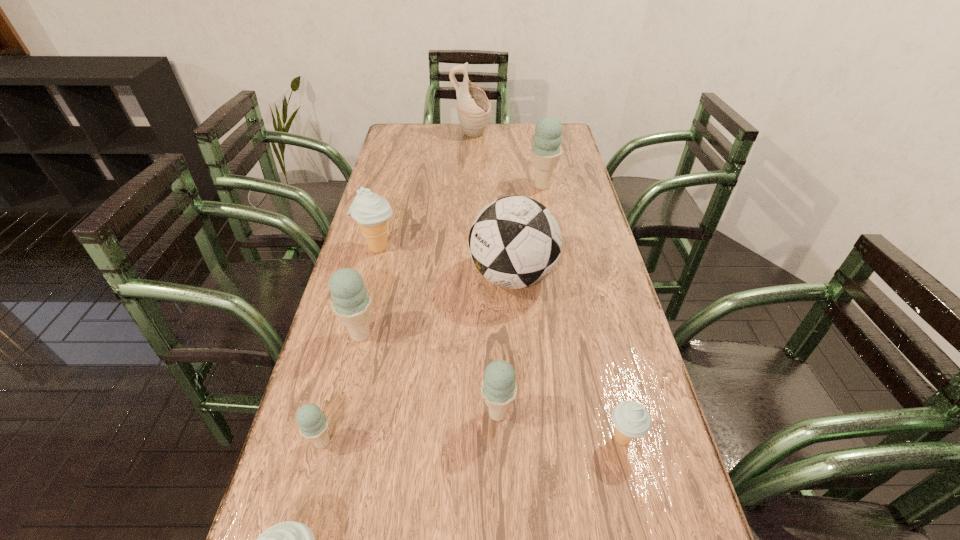
The width and height of the screenshot is (960, 540). In order to click on pitcher in this screenshot , I will do `click(473, 107)`.

Locate an element on the screen. Image resolution: width=960 pixels, height=540 pixels. the farthest blue ice cream is located at coordinates (546, 151).

This screenshot has width=960, height=540. What are the coordinates of `the rightmost blue ice cream` in the screenshot? It's located at (546, 151).

At what (x,y) coordinates should I click in order to perform the action: click on soccer ball. Please return your answer as a coordinate pair (x, y). Looking at the image, I should click on (515, 242).

Identify the location of the farthest beige icecream. The image size is (960, 540). (371, 212).

The image size is (960, 540). Identify the location of the biggest beige icecream. [x=371, y=212].

Find the location of `the third farthest ice cream`. the third farthest ice cream is located at coordinates (351, 302).

Where is `the third nearest blue ice cream`? This screenshot has height=540, width=960. the third nearest blue ice cream is located at coordinates (351, 302).

I want to click on the third blue ice cream from left to right, so click(x=498, y=388).

At what (x,y) coordinates should I click in order to perform the action: click on the fifth ice cream from left to right. Please return your answer as a coordinate pair (x, y). Looking at the image, I should click on (498, 388).